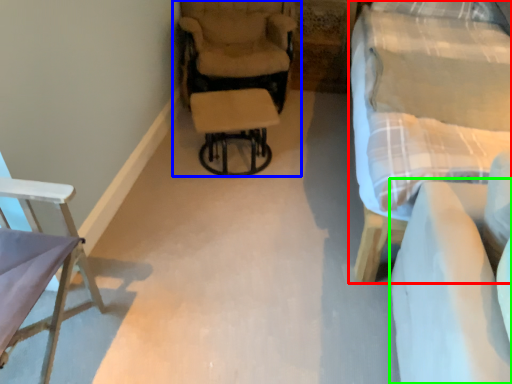
Question: Based on their relative distances, which object is farther from studio couch (highlighted by a red box)? Choose from chair (highlighted by a blue box) and couch (highlighted by a green box).

Choices:
 (A) chair
 (B) couch

Answer: (A)